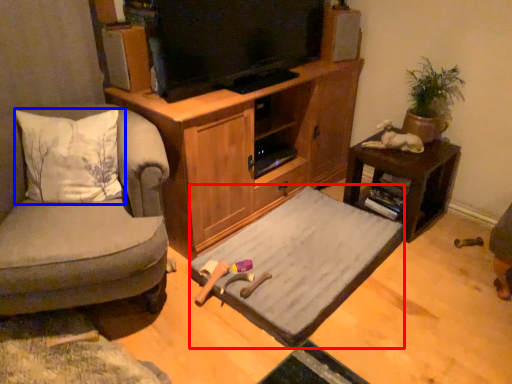
Question: Among these objects, which one is farthest to the camera, bed frame (highlighted by a red box) or pillow (highlighted by a blue box)?

Choices:
 (A) bed frame
 (B) pillow

Answer: (A)